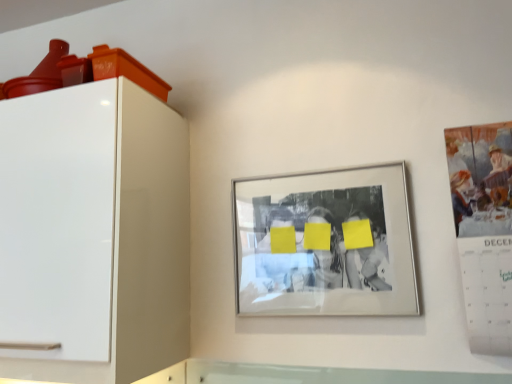
Question: Is white glossy cabinet at left outside matte paper calendar at right?

Choices:
 (A) no
 (B) yes

Answer: (B)

Question: Is white glossy cabinet at left positioned far away from matte paper calendar at right?

Choices:
 (A) yes
 (B) no

Answer: (B)

Question: Is white glossy cabinet at left beside matte paper calendar at right?

Choices:
 (A) no
 (B) yes

Answer: (A)

Question: Is white glossy cabinet at left taller than matte paper calendar at right?

Choices:
 (A) no
 (B) yes

Answer: (B)

Question: From a real-world perspective, is white glossy cabinet at left physically above matte paper calendar at right?

Choices:
 (A) yes
 (B) no

Answer: (A)

Question: Would you say silver metallic picture frame at center is to the left or to the right of white glossy cabinet at left in the picture?

Choices:
 (A) left
 (B) right

Answer: (B)

Question: Is point (237, 183) closer or farther from the camera than point (91, 132)?

Choices:
 (A) closer
 (B) farther

Answer: (B)

Question: In terms of size, does silver metallic picture frame at center appear bigger or smaller than white glossy cabinet at left?

Choices:
 (A) big
 (B) small

Answer: (B)

Question: From a real-world perspective, relative to white glossy cabinet at left, is silver metallic picture frame at center vertically above or below?

Choices:
 (A) above
 (B) below

Answer: (B)

Question: Looking at their shapes, would you say silver metallic picture frame at center is wider or thinner than matte paper calendar at right?

Choices:
 (A) wide
 (B) thin

Answer: (B)

Question: From a real-world perspective, is silver metallic picture frame at center physically located above or below matte paper calendar at right?

Choices:
 (A) below
 (B) above

Answer: (B)

Question: Do you think silver metallic picture frame at center is within matte paper calendar at right, or outside of it?

Choices:
 (A) inside
 (B) outside

Answer: (B)

Question: Based on their positions, is silver metallic picture frame at center located to the left or right of matte paper calendar at right?

Choices:
 (A) right
 (B) left

Answer: (B)

Question: Do you think white glossy cabinet at left is within matte paper calendar at right, or outside of it?

Choices:
 (A) outside
 (B) inside

Answer: (A)

Question: Is white glossy cabinet at left taller or shorter than matte paper calendar at right?

Choices:
 (A) short
 (B) tall

Answer: (B)